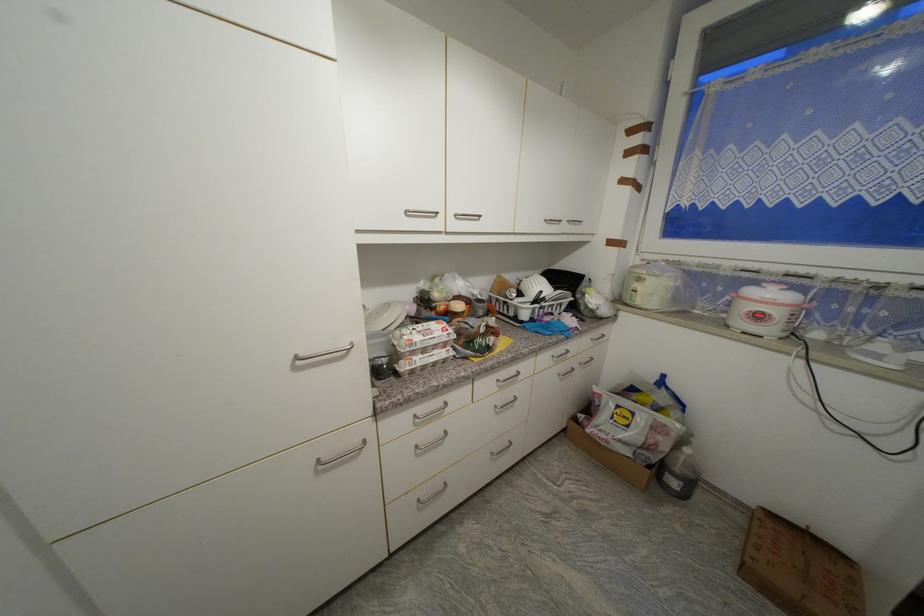
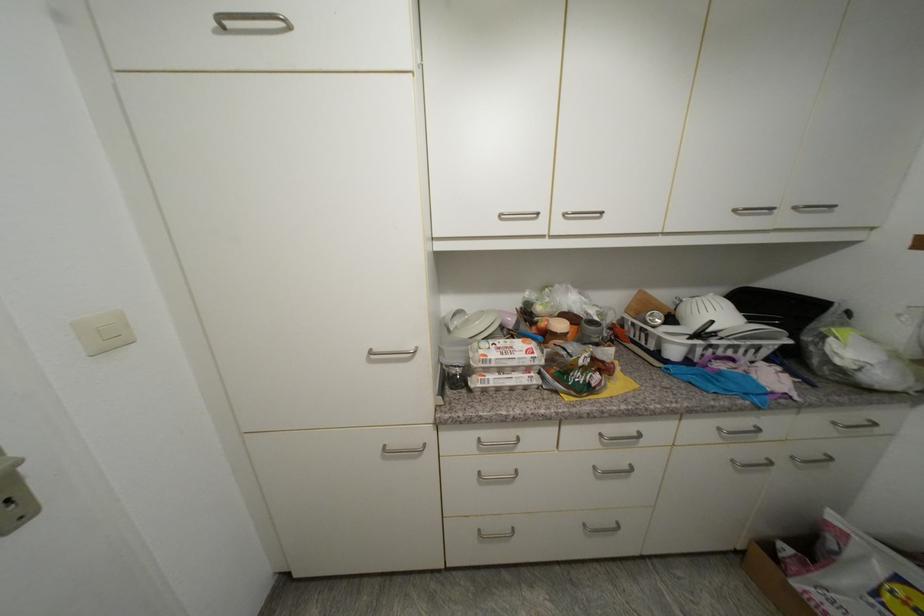
Locate, in the second image, the point that corresponds to the point at 574,223 in the first image.

(800, 209)